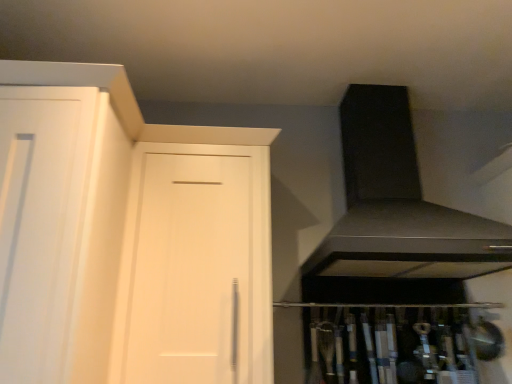
This screenshot has width=512, height=384. Describe the element at coordinates (398, 204) in the screenshot. I see `satin black exhaust hood at upper right` at that location.

In order to face satin black exhaust hood at upper right, should I rotate leftwards or rightwards?

A: To face it directly, rotate right by 18.503 degrees.

At what (x,y) coordinates should I click in order to perform the action: click on satin black exhaust hood at upper right. Please return your answer as a coordinate pair (x, y). Looking at the image, I should click on (398, 204).

I want to click on white matte door at center, so click(195, 267).

This screenshot has width=512, height=384. What do you see at coordinates (195, 267) in the screenshot?
I see `white matte door at center` at bounding box center [195, 267].

I want to click on satin black exhaust hood at upper right, so click(398, 204).

Considering the positions of objects white matte door at center and satin black exhaust hood at upper right in the image provided, who is more to the left, white matte door at center or satin black exhaust hood at upper right?

white matte door at center is more to the left.

Consider the image. Considering the positions of objects white matte door at center and satin black exhaust hood at upper right in the image provided, who is in front, white matte door at center or satin black exhaust hood at upper right?

Positioned in front is satin black exhaust hood at upper right.

Which is in front, point (208, 382) or point (445, 259)?

The point (208, 382) is closer to the camera.

From the image's perspective, which is below, white matte door at center or satin black exhaust hood at upper right?

white matte door at center, from the image's perspective.

From a real-world perspective, is white matte door at center above or below satin black exhaust hood at upper right?

In terms of real-world spatial position, white matte door at center is below satin black exhaust hood at upper right.

In terms of width, does white matte door at center look wider or thinner when compared to satin black exhaust hood at upper right?

Considering their sizes, white matte door at center looks slimmer than satin black exhaust hood at upper right.

Considering the relative sizes of white matte door at center and satin black exhaust hood at upper right in the image provided, is white matte door at center shorter than satin black exhaust hood at upper right?

No, white matte door at center is not shorter than satin black exhaust hood at upper right.

Does white matte door at center have a larger size compared to satin black exhaust hood at upper right?

Incorrect, white matte door at center is not larger than satin black exhaust hood at upper right.

Is white matte door at center situated inside satin black exhaust hood at upper right or outside?

white matte door at center is not enclosed by satin black exhaust hood at upper right.

Looking at this image, is white matte door at center beside satin black exhaust hood at upper right?

No, white matte door at center is not with satin black exhaust hood at upper right.

Is white matte door at center aimed at satin black exhaust hood at upper right?

No, white matte door at center is not oriented towards satin black exhaust hood at upper right.

How different are the orientations of white matte door at center and satin black exhaust hood at upper right in degrees?

They differ by 0.00618 degrees in their facing directions.

Locate an element on the screen. This screenshot has height=384, width=512. door behind the satin black exhaust hood at upper right is located at coordinates (195, 267).

Visually, is satin black exhaust hood at upper right positioned to the left or to the right of white matte door at center?

Based on their positions, satin black exhaust hood at upper right is located to the right of white matte door at center.

Is satin black exhaust hood at upper right closer to camera compared to white matte door at center?

Yes, satin black exhaust hood at upper right is closer to the viewer.

Does point (424, 205) come in front of point (252, 207)?

No.

From the image's perspective, between satin black exhaust hood at upper right and white matte door at center, who is located below?

white matte door at center, from the image's perspective.

From a real-world perspective, relative to white matte door at center, is satin black exhaust hood at upper right vertically above or below?

Clearly, from a real-world perspective, satin black exhaust hood at upper right is above white matte door at center.

Is satin black exhaust hood at upper right thinner than white matte door at center?

In fact, satin black exhaust hood at upper right might be wider than white matte door at center.

Considering the relative sizes of satin black exhaust hood at upper right and white matte door at center in the image provided, is satin black exhaust hood at upper right taller than white matte door at center?

No, satin black exhaust hood at upper right is not taller than white matte door at center.

Who is smaller, satin black exhaust hood at upper right or white matte door at center?

white matte door at center.

Is satin black exhaust hood at upper right outside of white matte door at center?

That's correct, satin black exhaust hood at upper right is outside of white matte door at center.

Is satin black exhaust hood at upper right touching white matte door at center?

No, satin black exhaust hood at upper right is not next to white matte door at center.

Is satin black exhaust hood at upper right oriented towards white matte door at center?

No, satin black exhaust hood at upper right is not facing towards white matte door at center.

You are a GUI agent. You are given a task and a screenshot of the screen. Output one action in this format:
    pyautogui.click(x=<x>, y=<y>)
    Task: Click on the exhaust hood in front of the white matte door at center
    This screenshot has height=384, width=512.
    Given the screenshot: What is the action you would take?
    pyautogui.click(x=398, y=204)

I want to click on door directly beneath the satin black exhaust hood at upper right (from a real-world perspective), so [x=195, y=267].

I want to click on door on the left of satin black exhaust hood at upper right, so click(x=195, y=267).